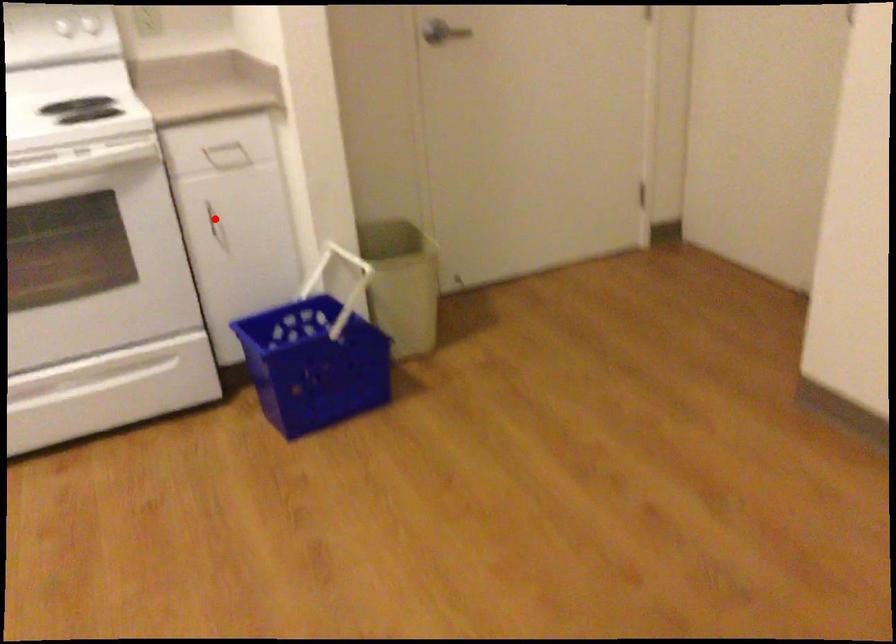
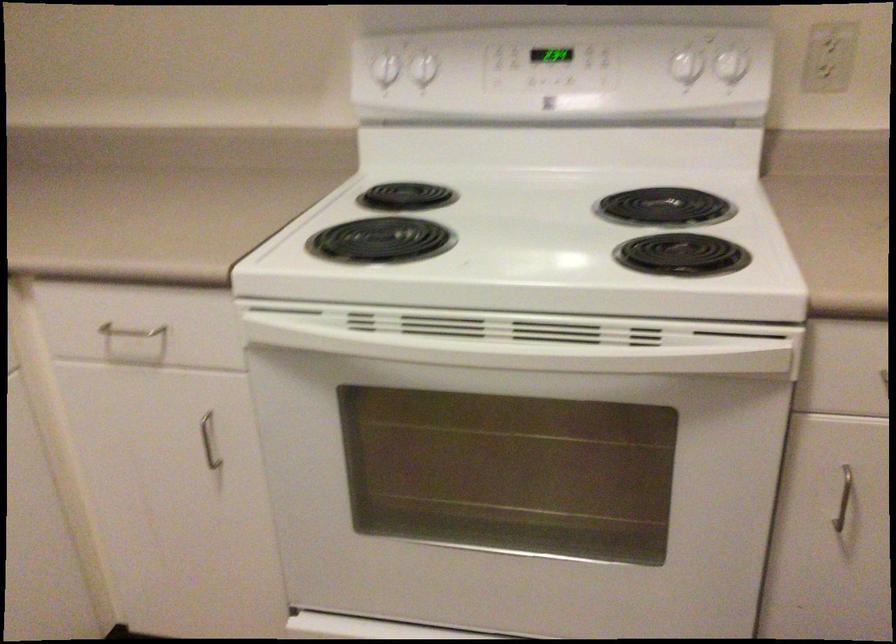
Question: I am providing you with two images of the same scene from different viewpoints. In image1, a red point is highlighted. Considering the same 3D point in image2, which of the following is correct?

Choices:
 (A) It is closer
 (B) It is farther

Answer: (A)